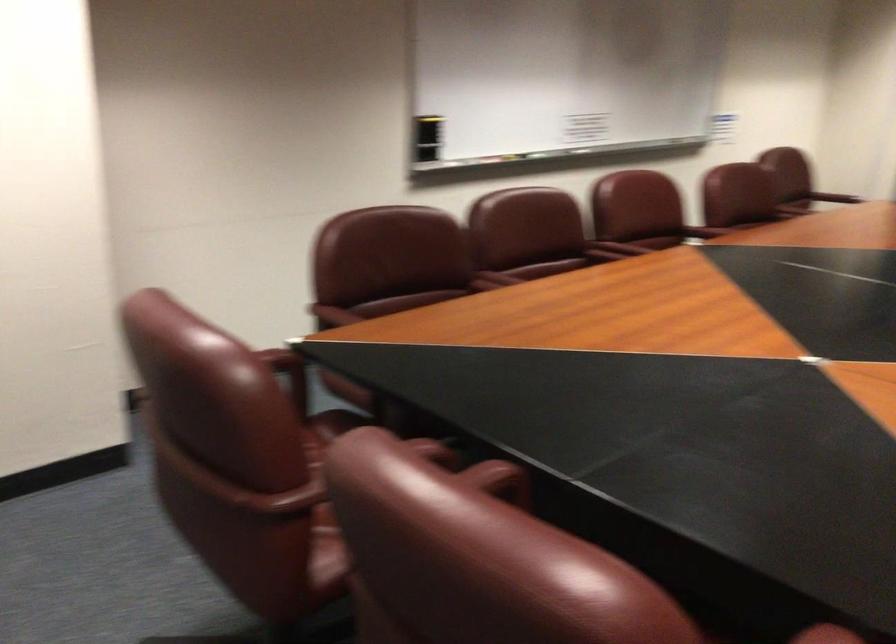
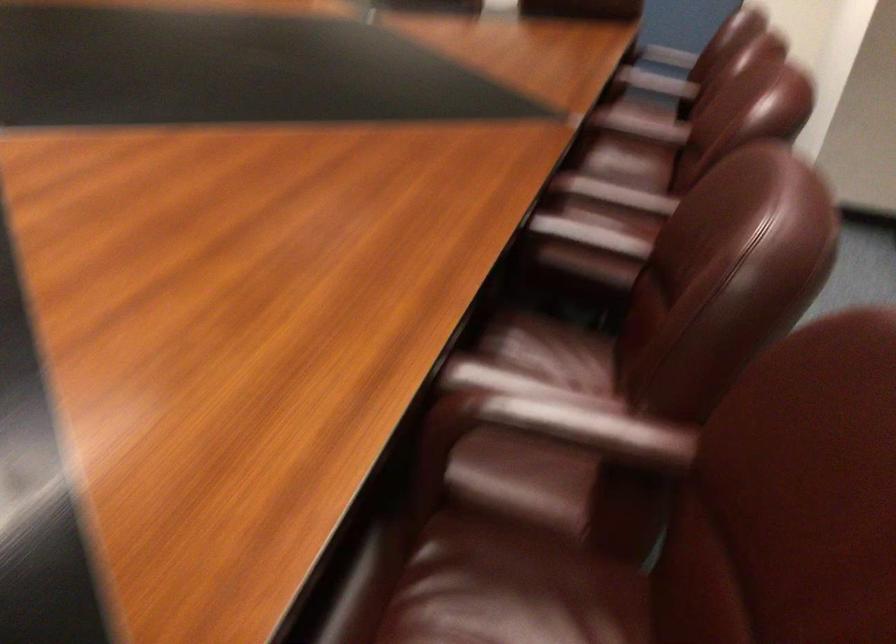
Find the pixel in the second image that matches (x=806, y=187) in the first image.

(532, 420)